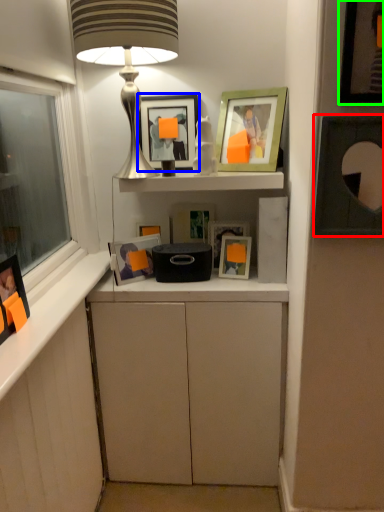
Question: Which object is the closest to the picture frame (highlighted by a red box)? Choose among these: picture frame (highlighted by a blue box) or picture frame (highlighted by a green box).

Choices:
 (A) picture frame
 (B) picture frame

Answer: (B)